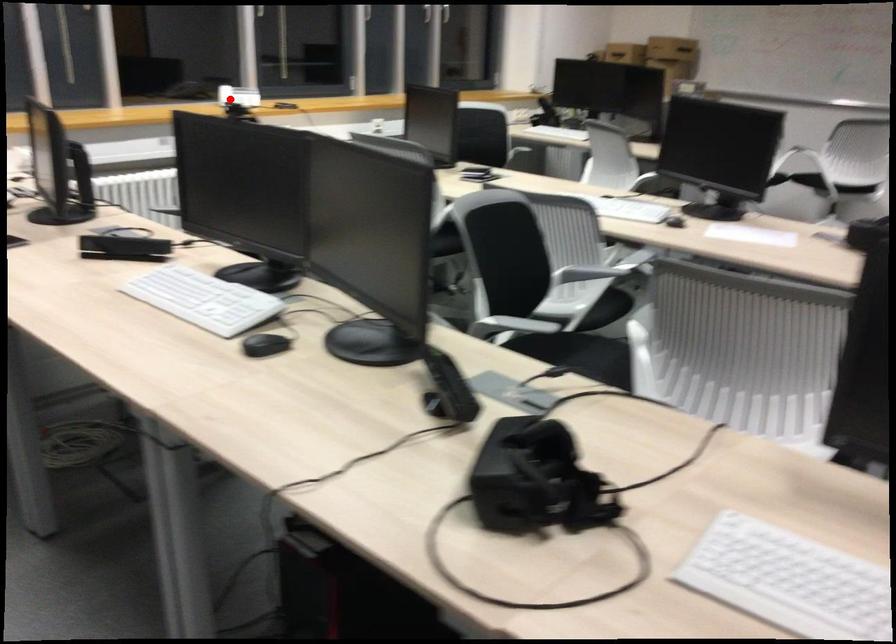
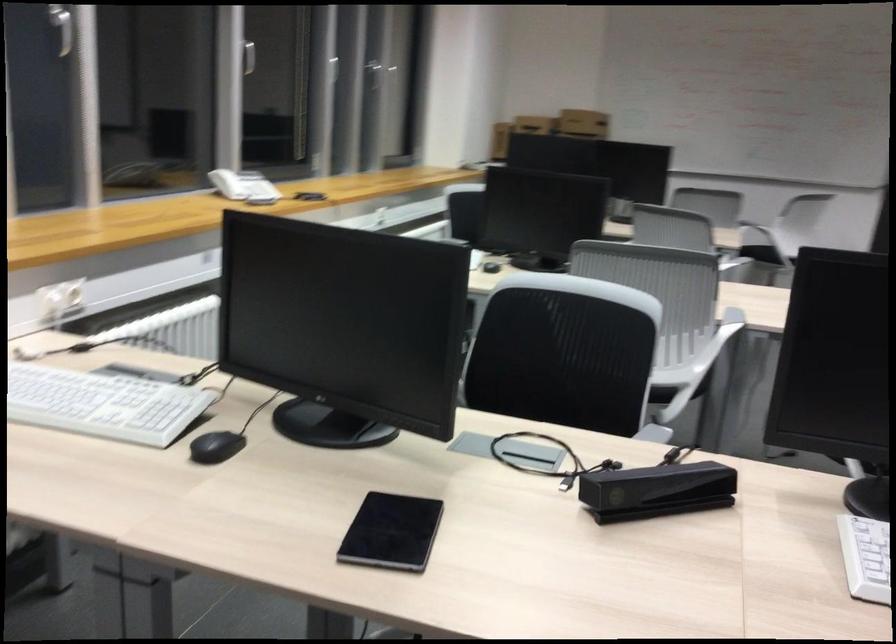
Question: I am providing you with two images of the same scene from different viewpoints. A red point is shown in image1. For the corresponding object point in image2, is it positioned nearer or farther from the camera?

Choices:
 (A) Nearer
 (B) Farther

Answer: (A)